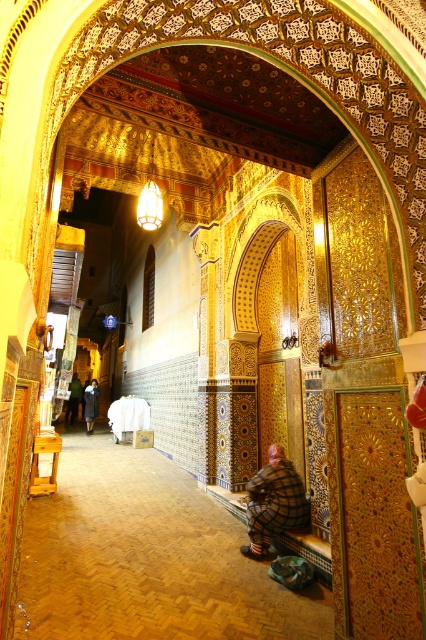
Can you confirm if plaid fabric person at lower center is taller than dark gray wool coat at left?

No.

Between point (250, 538) and point (80, 387), which one is positioned behind?

The point (80, 387) is behind.

Is point (253, 548) positioned behind point (72, 381)?

No, (253, 548) is closer to viewer.

I want to click on plaid fabric person at lower center, so click(273, 502).

In the scene shown: Is dark brown leather coat at center below dark gray wool coat at left?

Incorrect, dark brown leather coat at center is not positioned below dark gray wool coat at left.

Is point (97, 404) behind point (77, 387)?

No, it is not.

This screenshot has height=640, width=426. In order to click on dark brown leather coat at center in this screenshot , I will do (91, 404).

Is plaid fabric person at lower center closer to camera compared to dark brown leather coat at center?

Yes, it is in front of dark brown leather coat at center.

Is point (294, 502) closer to camera compared to point (97, 404)?

Yes.

Is point (285, 460) more distant than point (89, 420)?

No, (285, 460) is in front of (89, 420).

You are a GUI agent. You are given a task and a screenshot of the screen. Output one action in this format:
    pyautogui.click(x=<x>, y=<y>)
    Task: Click on the plaid fabric person at lower center
    
    Given the screenshot: What is the action you would take?
    pyautogui.click(x=273, y=502)